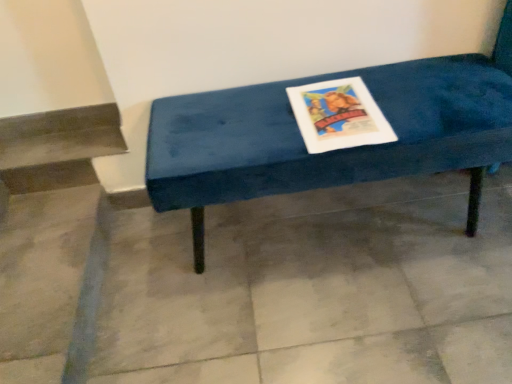
This screenshot has height=384, width=512. Identify the location of free point above gray tile floor at center (from a real-world perspective). (309, 277).